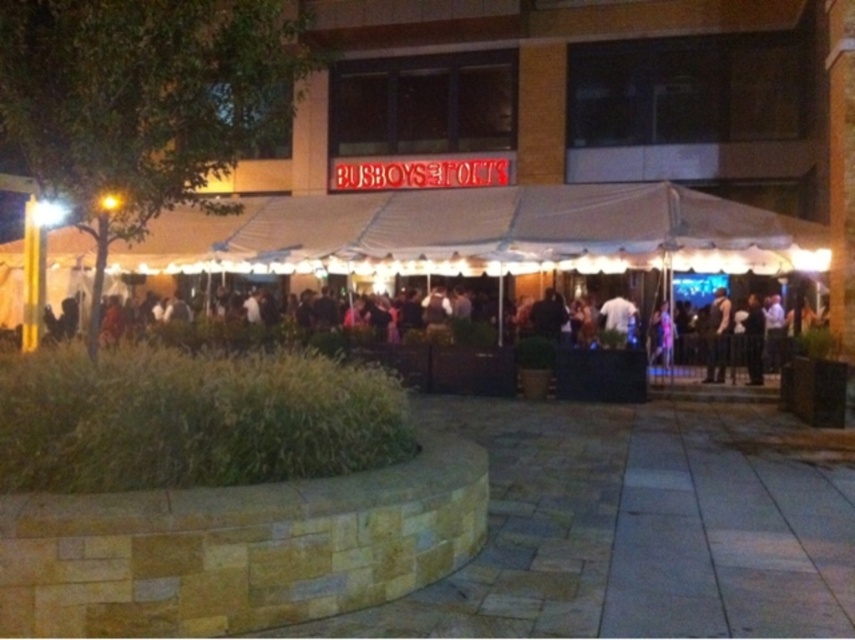
You are at an event and need to exit the venue. You see a white tent at center and a black fabric tent at center. Which tent is closer to the exit located behind the BUBBOYS FOLK venue building?

The black fabric tent at center is behind the white tent at center, so the white tent at center is closer to the exit located behind the BUBBOYS FOLK venue building.

You are attending an outdoor event and see the white tent at center and the dark brown leather jacket at center. Which object is located above the other?

The white tent at center is positioned over the dark brown leather jacket at center, meaning the tent is above the jacket.

You are standing at the point marked by the coordinates point (x=482, y=234). What object are you standing on?

You are standing on the white tent at center.